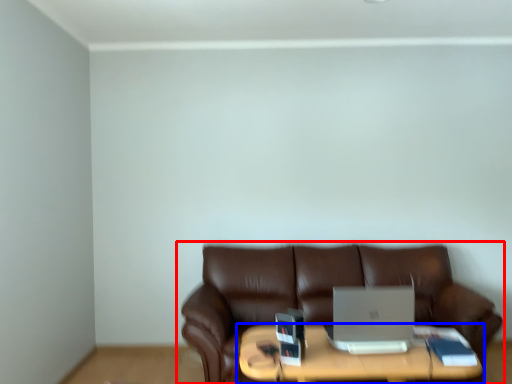
Question: Among these objects, which one is farthest to the camera, studio couch (highlighted by a red box) or table (highlighted by a blue box)?

Choices:
 (A) studio couch
 (B) table

Answer: (A)